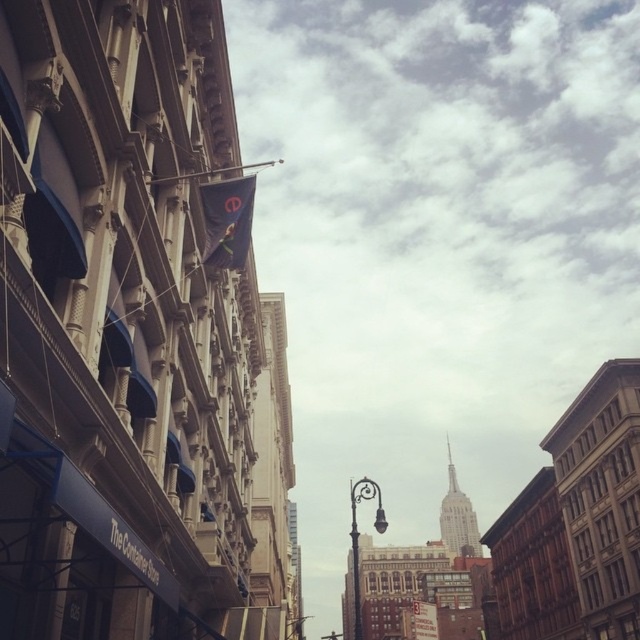
Who is more forward, (x=225, y=236) or (x=250, y=164)?

Positioned in front is point (x=225, y=236).

Is dark blue fabric flag at upper center smaller than metallic flagpole at upper center?

Indeed, dark blue fabric flag at upper center has a smaller size compared to metallic flagpole at upper center.

Find the location of a particular element. This screenshot has height=640, width=640. dark blue fabric flag at upper center is located at coordinates (227, 221).

Can you confirm if black metal streetlight at center is smaller than metallic flagpole at upper center?

Yes.

Is point (376, 509) positioned behind point (148, 182)?

That is True.

Is point (374, 492) closer to camera compared to point (259, 163)?

Yes, it is.

Identify the location of black metal streetlight at center. tap(358, 536).

Does point (234, 182) come closer to viewer compared to point (358, 584)?

Yes, it is.

Is dark blue fabric flag at upper center wider than black metal streetlight at center?

Incorrect, dark blue fabric flag at upper center's width does not surpass black metal streetlight at center's.

I want to click on dark blue fabric flag at upper center, so click(227, 221).